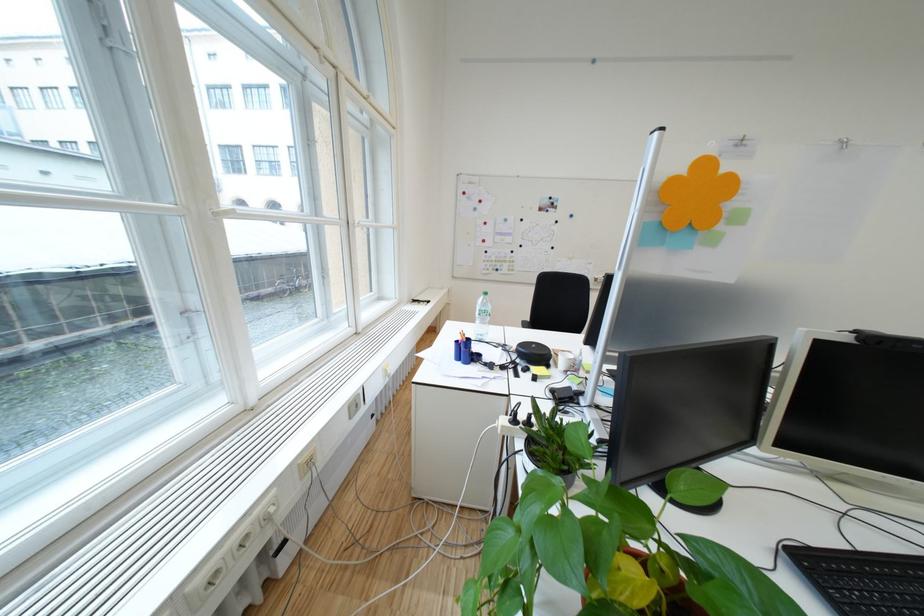
The height and width of the screenshot is (616, 924). What do you see at coordinates (306, 462) in the screenshot?
I see `the power strip switch` at bounding box center [306, 462].